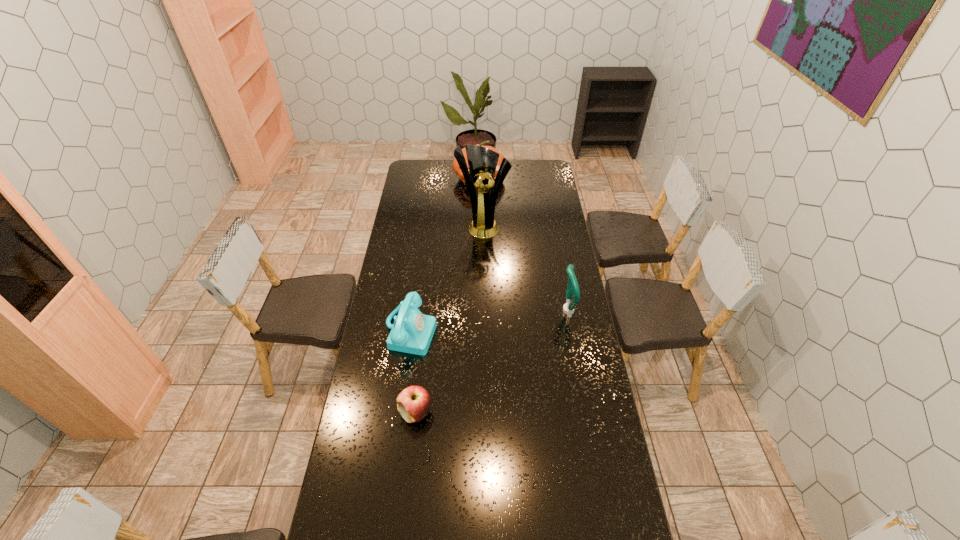
Image resolution: width=960 pixels, height=540 pixels. Find the location of `the nearest object`. the nearest object is located at coordinates (413, 403).

Where is `the shortest object`? The image size is (960, 540). the shortest object is located at coordinates (413, 403).

Locate an element on the screen. This screenshot has height=540, width=960. the rightmost object is located at coordinates point(572,287).

Locate an element on the screen. the second shortest object is located at coordinates (412, 332).

You are a GUI agent. You are given a task and a screenshot of the screen. Output one action in this format:
    pyautogui.click(x=<x>, y=<y>)
    Task: Click on the second farthest object
    The image size is (960, 540).
    Given the screenshot: What is the action you would take?
    pyautogui.click(x=482, y=162)

The image size is (960, 540). Find the location of `award`. award is located at coordinates (482, 162).

Image resolution: width=960 pixels, height=540 pixels. I want to click on pumpkin, so click(455, 165).

At what (x,y) coordinates should I click in order to perform the action: click on vacant space located on the bitten side of the apple. Please return your answer as a coordinate pair (x, y). Image resolution: width=960 pixels, height=540 pixels. Looking at the image, I should click on tap(356, 413).

Where is `free location located on the bitten side of the apple`? This screenshot has width=960, height=540. free location located on the bitten side of the apple is located at coordinates (381, 413).

Identify the location of vacant space located 0.080m on the bitten side of the apple. Image resolution: width=960 pixels, height=540 pixels. (376, 413).